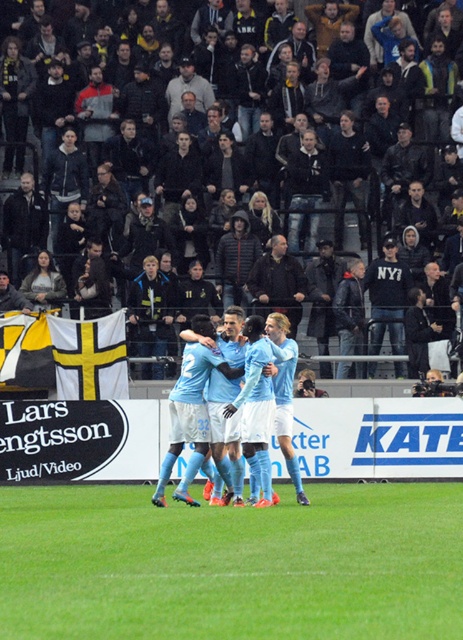
Question: Does green grass at center appear under dark gray hoodies at center?

Choices:
 (A) no
 (B) yes

Answer: (B)

Question: Which of these objects is positioned closest to the light blue jersey at center?

Choices:
 (A) dark gray hoodies at center
 (B) green grass at center

Answer: (B)

Question: Which object is closer to the camera taking this photo?

Choices:
 (A) light blue jersey at center
 (B) dark gray hoodies at center

Answer: (A)

Question: Which object appears closest to the camera in this image?

Choices:
 (A) light blue jersey at center
 (B) green grass at center
 (C) dark gray hoodies at center

Answer: (B)

Question: In this image, where is green grass at center located relative to dark gray hoodies at center?

Choices:
 (A) left
 (B) right

Answer: (B)

Question: Is green grass at center below dark gray hoodies at center?

Choices:
 (A) no
 (B) yes

Answer: (B)